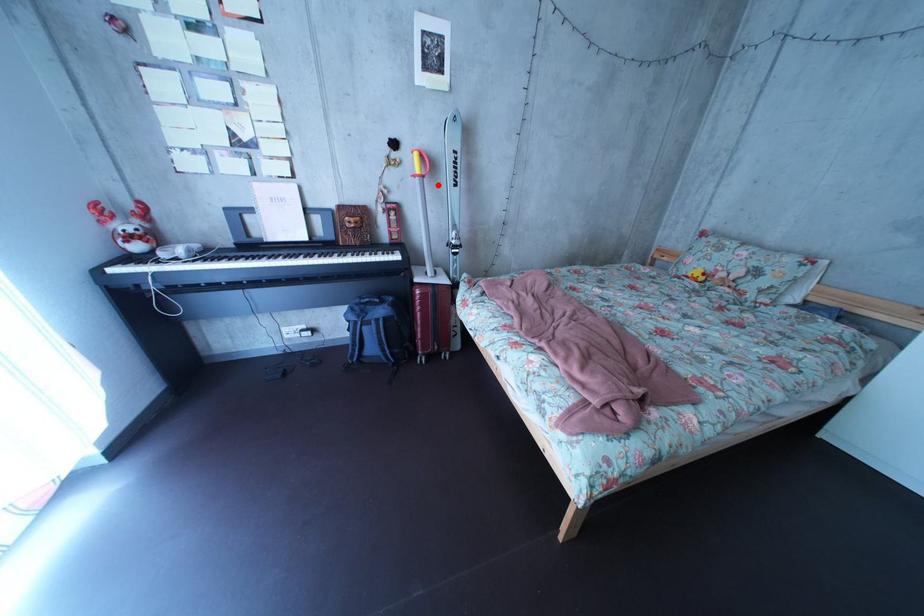
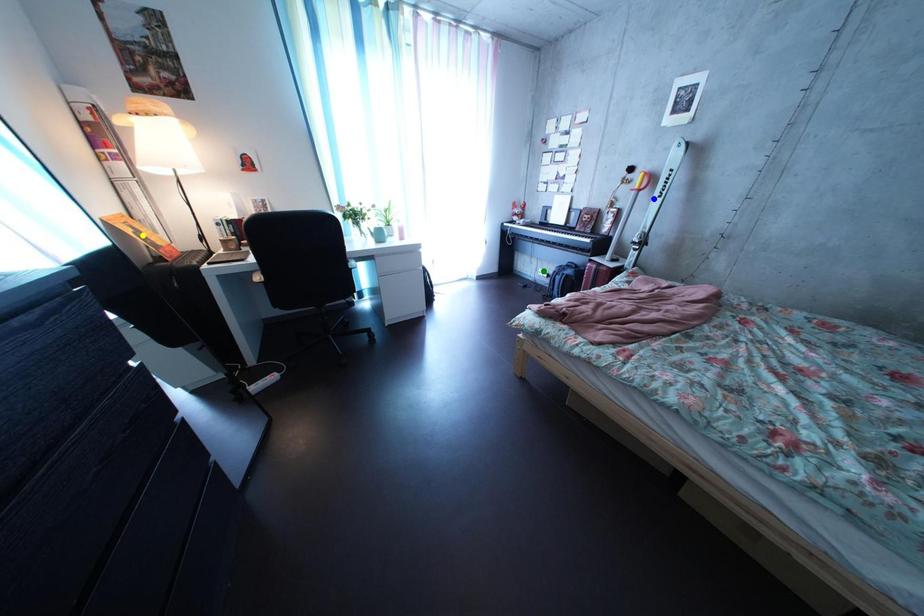
Question: I am providing you with two images of the same scene from different viewpoints. A red point is marked on the first image. You are given multiple points on the second image. In image 2, which mark is for the same physical point as the one in image 1?

Choices:
 (A) blue point
 (B) green point
 (C) yellow point

Answer: (A)